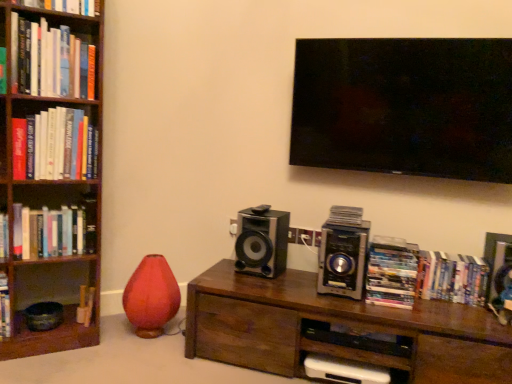
Question: Is black glossy speaker at center, placed as the first speaker when sorted from left to right, smaller than hardcover book at left, marked as the seventh book in a right-to-left arrangement?

Choices:
 (A) no
 (B) yes

Answer: (A)

Question: Is black glossy speaker at center, placed as the first speaker when sorted from left to right, shorter than hardcover book at left, which is the first book from left to right?

Choices:
 (A) no
 (B) yes

Answer: (A)

Question: Would you say black glossy speaker at center, placed as the first speaker when sorted from left to right, is outside hardcover book at left, the fourth book viewed from the top?

Choices:
 (A) no
 (B) yes

Answer: (B)

Question: Does black glossy speaker at center, placed as the first speaker when sorted from left to right, appear on the left side of hardcover book at left, the fourth book positioned from the bottom?

Choices:
 (A) yes
 (B) no

Answer: (B)

Question: Does black glossy speaker at center, which appears as the second speaker when viewed from the right, have a larger size compared to hardcover book at left, which is the first book from left to right?

Choices:
 (A) yes
 (B) no

Answer: (A)

Question: Are black glossy speaker at center, placed as the first speaker when sorted from left to right, and hardcover book at left, which is the first book from left to right, located far from each other?

Choices:
 (A) yes
 (B) no

Answer: (B)

Question: From the image's perspective, does hardcover book at left, the fourth book positioned from the bottom, appear higher than hardcover books at center right, which is the fifth book in top-to-bottom order?

Choices:
 (A) no
 (B) yes

Answer: (B)

Question: Is the depth of hardcover book at left, the fourth book positioned from the bottom, greater than that of hardcover books at center right, which is the 3th book from bottom to top?

Choices:
 (A) yes
 (B) no

Answer: (A)

Question: Does hardcover book at left, which is the first book from left to right, have a smaller size compared to hardcover books at center right, the 6th book in the left-to-right sequence?

Choices:
 (A) yes
 (B) no

Answer: (B)

Question: Does hardcover book at left, marked as the seventh book in a right-to-left arrangement, contain hardcover books at center right, which is the fifth book in top-to-bottom order?

Choices:
 (A) yes
 (B) no

Answer: (B)

Question: Considering the relative sizes of hardcover book at left, the fourth book viewed from the top, and hardcover books at center right, which is the fifth book in top-to-bottom order, in the image provided, is hardcover book at left, the fourth book viewed from the top, wider than hardcover books at center right, which is the fifth book in top-to-bottom order,?

Choices:
 (A) no
 (B) yes

Answer: (A)

Question: Does hardcover book at left, the fourth book viewed from the top, have a lesser height compared to hardcover books at center right, which is the 3th book from bottom to top?

Choices:
 (A) yes
 (B) no

Answer: (A)

Question: Is the position of hardcover books at center right, the 1th book from the right, less distant than that of hardcover book at upper left, arranged as the 1th book when viewed from the top?

Choices:
 (A) yes
 (B) no

Answer: (B)